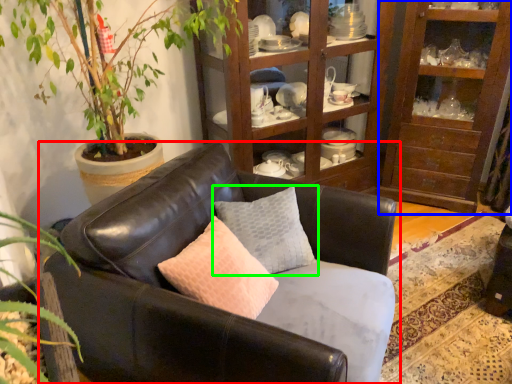
Question: Considering the real-world distances, which object is farthest from studio couch (highlighted by a red box)? shelf (highlighted by a blue box) or pillow (highlighted by a green box)?

Choices:
 (A) shelf
 (B) pillow

Answer: (A)